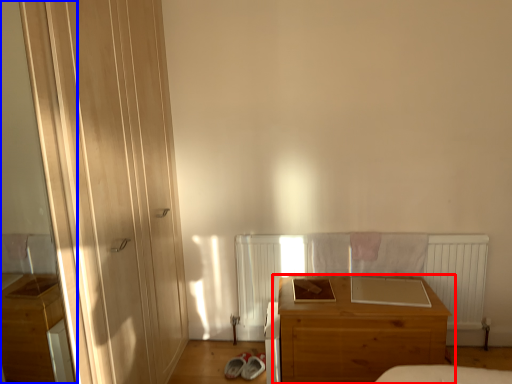
Question: Among these objects, which one is nearest to the camera, chest of drawers (highlighted by a red box) or screen door (highlighted by a blue box)?

Choices:
 (A) chest of drawers
 (B) screen door

Answer: (B)